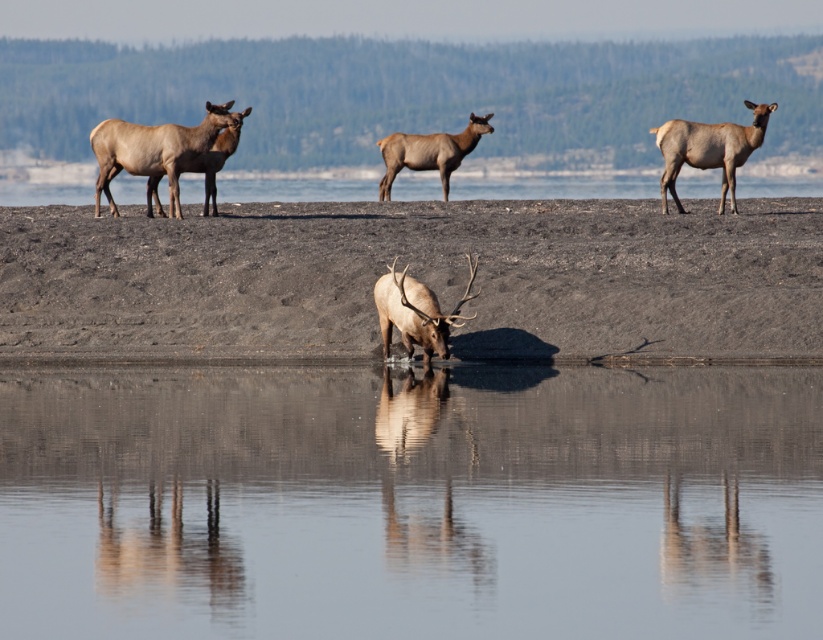
Measure the distance between brown velvet deer at upper right and camera.

The distance of brown velvet deer at upper right from camera is 82.62 feet.

Is brown velvet deer at upper right positioned in front of brown velvet deer at center?

Yes, it is in front of brown velvet deer at center.

Does point (686, 147) come in front of point (445, 148)?

Yes.

Find the location of a particular element. brown velvet deer at upper right is located at coordinates (708, 148).

In the scene shown: Who is more distant from viewer, (x=463, y=545) or (x=433, y=316)?

Positioned behind is point (x=433, y=316).

Which is more to the left, clear water at center or shiny brown antlered deer at center?

From the viewer's perspective, shiny brown antlered deer at center appears more on the left side.

Where is `clear water at center`? The height and width of the screenshot is (640, 823). clear water at center is located at coordinates (410, 500).

Where is `clear water at center`? Image resolution: width=823 pixels, height=640 pixels. clear water at center is located at coordinates (410, 500).

Can you confirm if brown velvet deer at upper right is taller than shiny brown antlered deer at center?

Yes, brown velvet deer at upper right is taller than shiny brown antlered deer at center.

Is brown velvet deer at upper right below shiny brown antlered deer at center?

No.

This screenshot has width=823, height=640. What do you see at coordinates (708, 148) in the screenshot?
I see `brown velvet deer at upper right` at bounding box center [708, 148].

What are the coordinates of `brown velvet deer at upper right` in the screenshot? It's located at (708, 148).